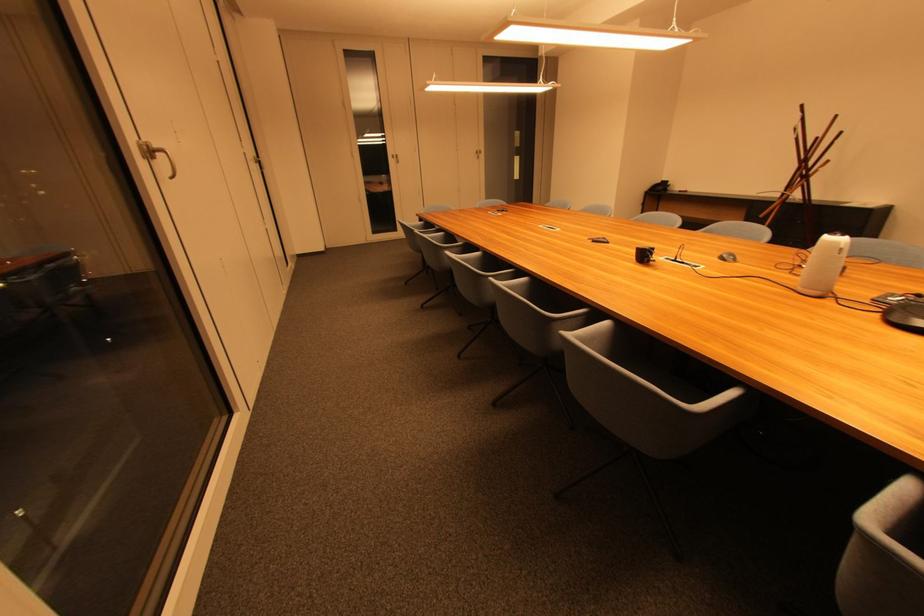
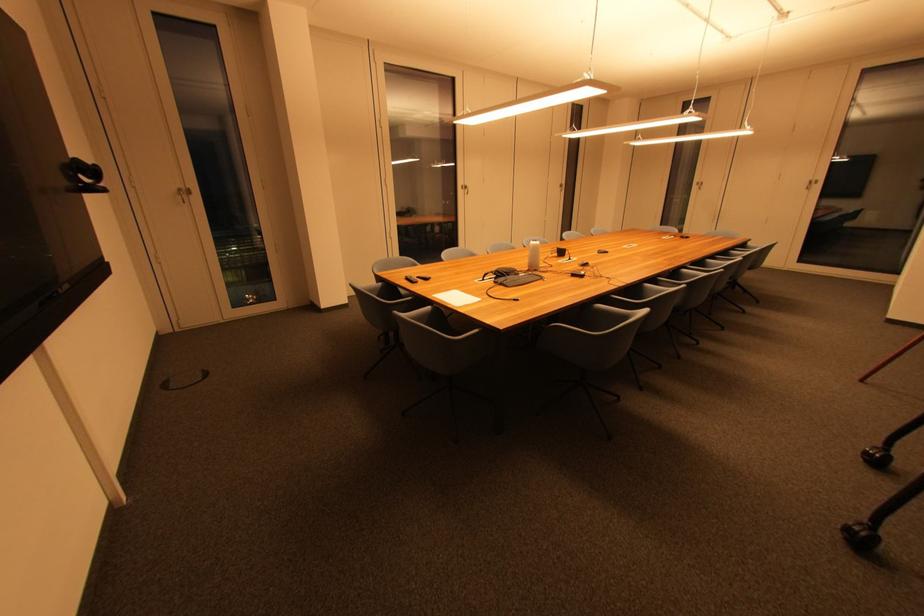
Where in the second image is the point corresponding to the point at 148,159 from the first image?

(468, 190)